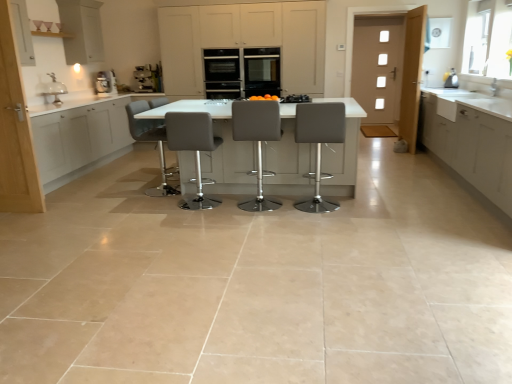
Question: Does metallic silver kettle at upper right, the 1th appliance positioned from the bottom, have a greater width compared to grey leather stool at center, the fourth chair positioned from the left?

Choices:
 (A) no
 (B) yes

Answer: (A)

Question: From a real-world perspective, is metallic silver kettle at upper right, the 2th appliance positioned from the left, beneath grey leather stool at center, the fourth chair positioned from the left?

Choices:
 (A) yes
 (B) no

Answer: (B)

Question: Is metallic silver kettle at upper right, marked as the second appliance in a back-to-front arrangement, to the left of grey leather stool at center, the fourth chair positioned from the left, from the viewer's perspective?

Choices:
 (A) yes
 (B) no

Answer: (B)

Question: Can we say metallic silver kettle at upper right, the first appliance in the front-to-back sequence, lies outside grey leather stool at center, the fourth chair positioned from the left?

Choices:
 (A) no
 (B) yes

Answer: (B)

Question: From a real-world perspective, does metallic silver kettle at upper right, which appears as the second appliance when viewed from the top, stand above grey leather stool at center, the fourth chair positioned from the left?

Choices:
 (A) yes
 (B) no

Answer: (A)

Question: Is matte white cabinet at upper left, the fifth cabinetry viewed from the right, bigger or smaller than white matte cabinet at left, which is the third cabinetry in right-to-left order?

Choices:
 (A) big
 (B) small

Answer: (A)

Question: Is matte white cabinet at upper left, the fifth cabinetry viewed from the right, taller or shorter than white matte cabinet at left, which is the third cabinetry in right-to-left order?

Choices:
 (A) tall
 (B) short

Answer: (B)

Question: Considering the relative positions of matte white cabinet at upper left, the fifth cabinetry viewed from the right, and white matte cabinet at left, which is the third cabinetry in right-to-left order, in the image provided, is matte white cabinet at upper left, the fifth cabinetry viewed from the right, to the left or to the right of white matte cabinet at left, which is the third cabinetry in right-to-left order,?

Choices:
 (A) left
 (B) right

Answer: (A)

Question: From a real-world perspective, relative to white matte cabinet at left, which is the third cabinetry in right-to-left order, is matte white cabinet at upper left, the fifth cabinetry viewed from the right, vertically above or below?

Choices:
 (A) above
 (B) below

Answer: (A)

Question: Considering the positions of matte black oven at center, the second appliance viewed from the front, and metallic gray coffee machine at upper left, marked as the 1th coffee machine in a left-to-right arrangement, in the image, is matte black oven at center, the second appliance viewed from the front, wider or thinner than metallic gray coffee machine at upper left, marked as the 1th coffee machine in a left-to-right arrangement,?

Choices:
 (A) wide
 (B) thin

Answer: (A)

Question: Is matte black oven at center, the second appliance viewed from the front, in front of or behind metallic gray coffee machine at upper left, marked as the 1th coffee machine in a left-to-right arrangement, in the image?

Choices:
 (A) front
 (B) behind

Answer: (A)

Question: From their relative heights in the image, would you say matte black oven at center, which is counted as the first appliance, starting from the back, is taller or shorter than metallic gray coffee machine at upper left, marked as the 1th coffee machine in a left-to-right arrangement?

Choices:
 (A) tall
 (B) short

Answer: (A)

Question: From a real-world perspective, is matte black oven at center, marked as the 2th appliance in a bottom-to-top arrangement, positioned above or below metallic gray coffee machine at upper left, marked as the 1th coffee machine in a left-to-right arrangement?

Choices:
 (A) above
 (B) below

Answer: (A)

Question: Considering their positions, is metallic gray coffee machine at upper left, marked as the 1th coffee machine in a left-to-right arrangement, located in front of or behind satin silver coffee machine at center, the 1th coffee machine when ordered from right to left?

Choices:
 (A) front
 (B) behind

Answer: (A)

Question: In terms of size, does metallic gray coffee machine at upper left, the 2th coffee machine when ordered from right to left, appear bigger or smaller than satin silver coffee machine at center, acting as the second coffee machine starting from the left?

Choices:
 (A) big
 (B) small

Answer: (B)